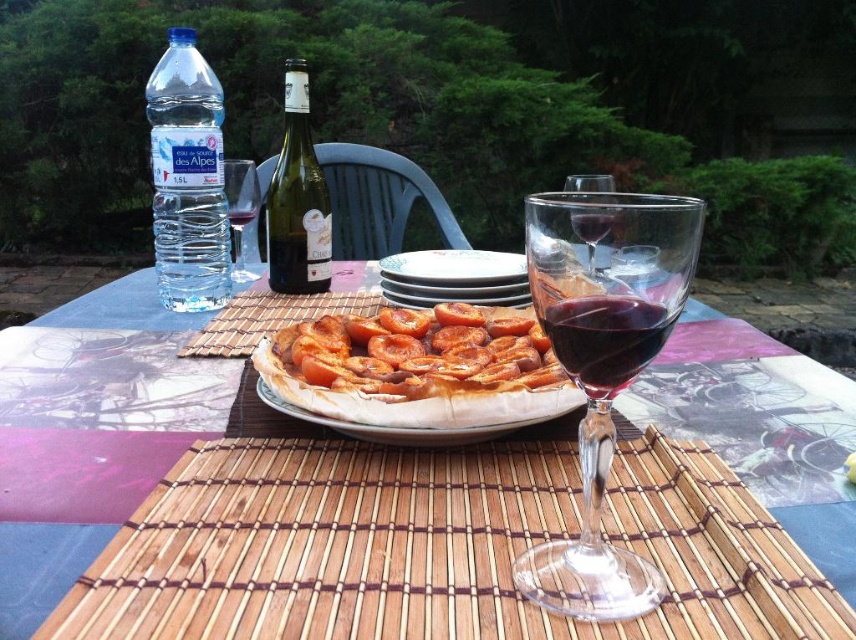
Does transparent glass wine glass at center have a lesser height compared to clear glass bottle of white wine at upper center?

No.

Who is positioned more to the right, transparent glass wine glass at center or clear glass bottle of white wine at upper center?

From the viewer's perspective, transparent glass wine glass at center appears more on the right side.

Who is more forward, (637, 588) or (244, 218)?

Point (637, 588)

Locate an element on the screen. This screenshot has height=640, width=856. transparent glass wine glass at center is located at coordinates click(603, 369).

Does white ceramic plates at center have a lesser width compared to transparent glass at center?

In fact, white ceramic plates at center might be wider than transparent glass at center.

Which is below, white ceramic plates at center or transparent glass at center?

transparent glass at center

Locate an element on the screen. This screenshot has height=640, width=856. white ceramic plates at center is located at coordinates (455, 266).

Between transparent glass at center and clear glass bottle of white wine at upper center, which one has more height?

With more height is clear glass bottle of white wine at upper center.

Can you confirm if transparent glass at center is shorter than clear glass bottle of white wine at upper center?

Indeed, transparent glass at center has a lesser height compared to clear glass bottle of white wine at upper center.

The height and width of the screenshot is (640, 856). What do you see at coordinates (591, 225) in the screenshot?
I see `transparent glass at center` at bounding box center [591, 225].

Where is `transparent glass at center`? transparent glass at center is located at coordinates (591, 225).